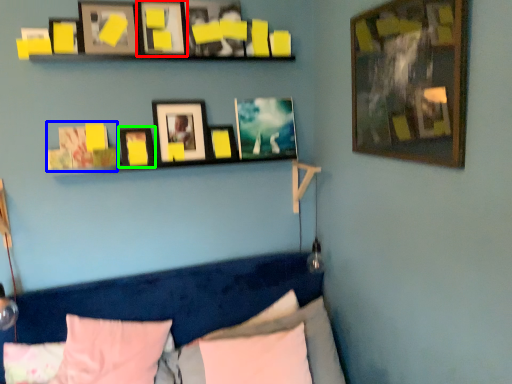
Question: Which is farther away from picture frame (highlighted by a red box)? picture frame (highlighted by a blue box) or picture frame (highlighted by a green box)?

Choices:
 (A) picture frame
 (B) picture frame

Answer: (A)